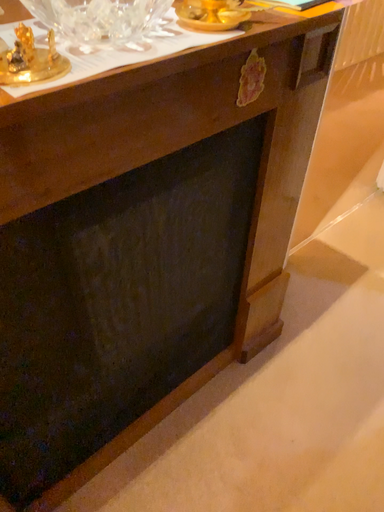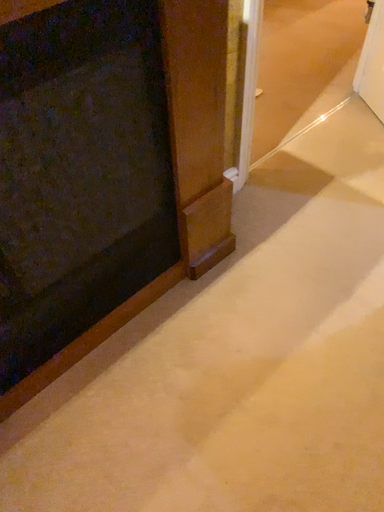
Question: Which way did the camera rotate in the video?

Choices:
 (A) rotated upward
 (B) rotated downward

Answer: (B)